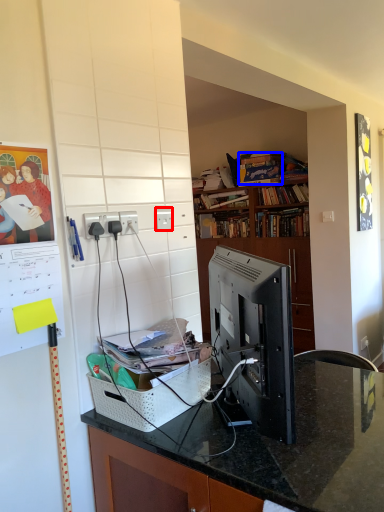
Question: Which of the following is the closest to the observer, electric outlet (highlighted by a red box) or book (highlighted by a blue box)?

Choices:
 (A) electric outlet
 (B) book

Answer: (A)